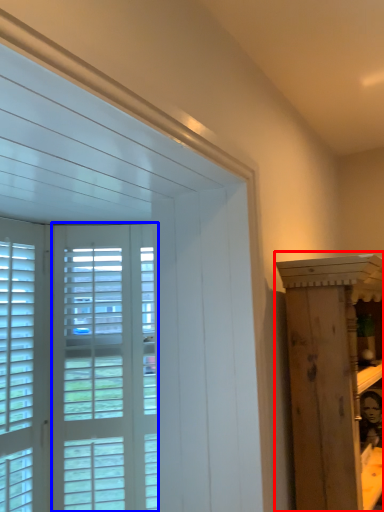
Question: Which object appears closest to the camera in this image, furniture (highlighted by a red box) or screen door (highlighted by a blue box)?

Choices:
 (A) furniture
 (B) screen door

Answer: (A)